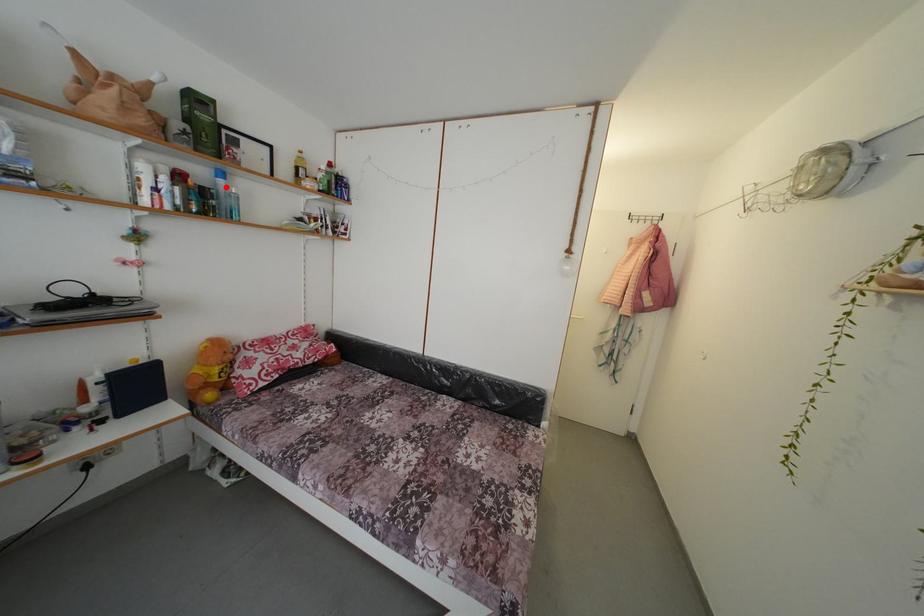
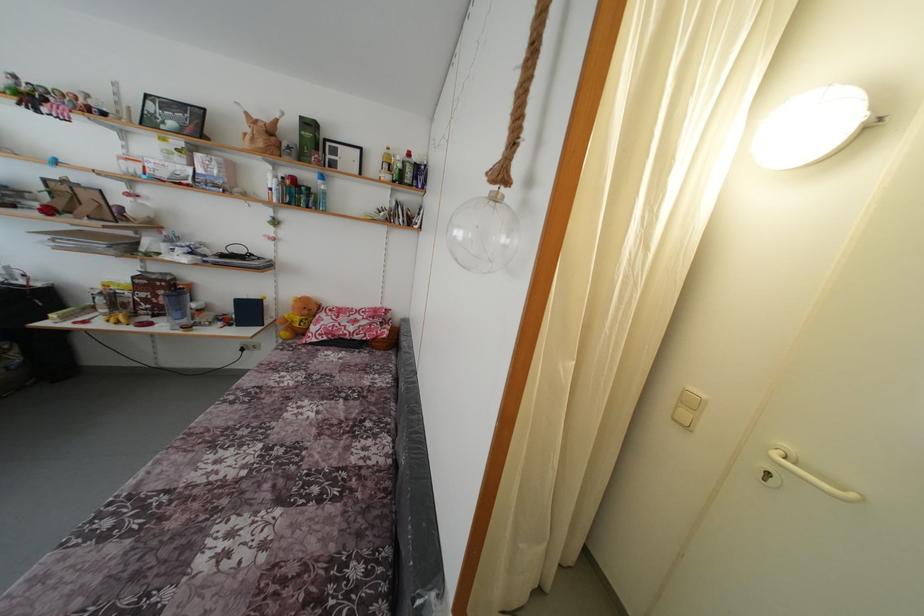
The point at the highlighted location is marked in the first image. Where is the corresponding point in the second image?

(324, 188)